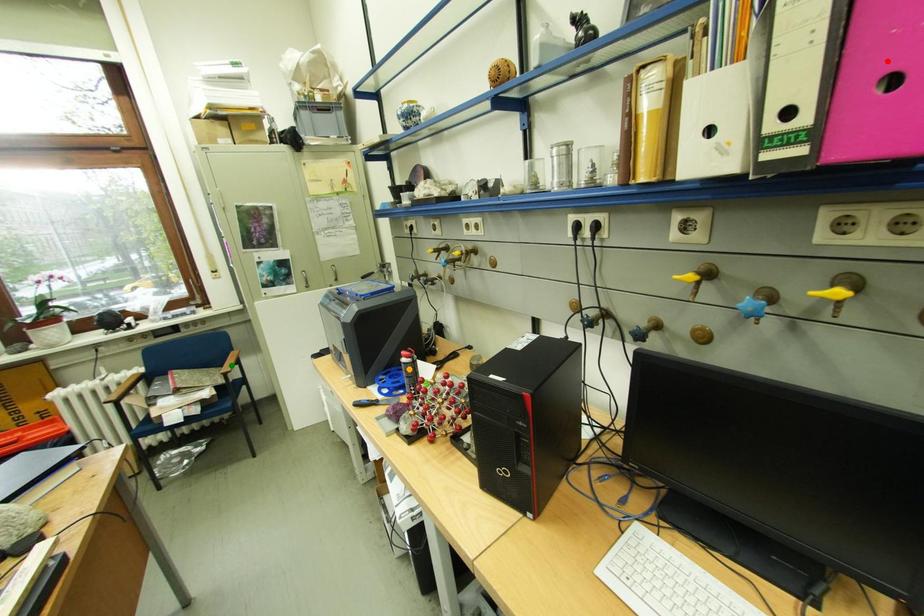
Order these from nearest to farthest:
green point | red point | orange point

red point, orange point, green point